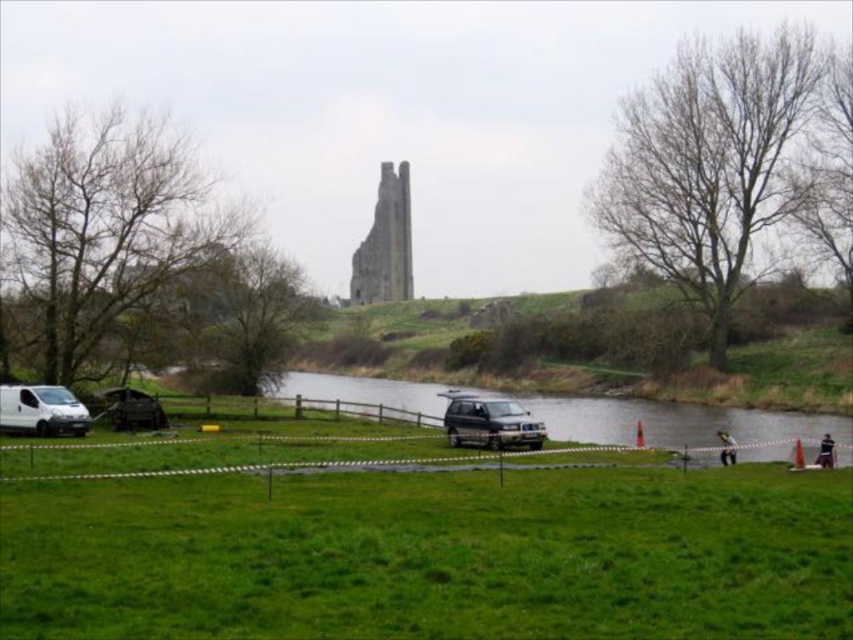
Is the position of green grassy river at center less distant than that of white matte van at lower left?

That is True.

This screenshot has height=640, width=853. Identify the location of green grassy river at center. (685, 426).

Locate an element on the screen. Image resolution: width=853 pixels, height=640 pixels. green grassy river at center is located at coordinates (685, 426).

Does green grass at center appear on the right side of metallic dark gray suv at lower left?

Indeed, green grass at center is positioned on the right side of metallic dark gray suv at lower left.

What are the coordinates of `green grass at center` in the screenshot? It's located at (432, 554).

Image resolution: width=853 pixels, height=640 pixels. I want to click on green grass at center, so click(432, 554).

Find the location of `green grass at center`. green grass at center is located at coordinates (432, 554).

Between green grassy river at center and satin silver suv at center, which one is positioned lower?

green grassy river at center

Is green grassy river at center below satin silver suv at center?

Indeed, green grassy river at center is positioned under satin silver suv at center.

Find the location of a particular element. The height and width of the screenshot is (640, 853). green grassy river at center is located at coordinates (685, 426).